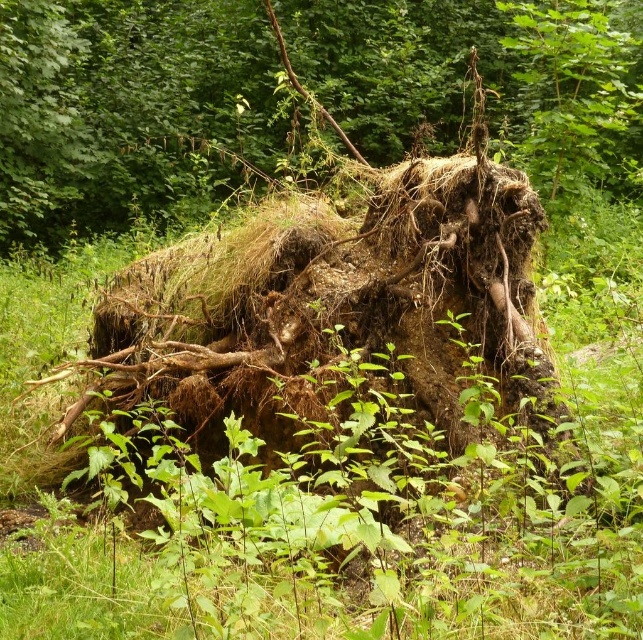
Measure the distance between brown/rooty tree stump at center and green leafy grass at center.

They are 7.78 meters apart.

The height and width of the screenshot is (640, 643). What do you see at coordinates (296, 97) in the screenshot?
I see `brown/rooty tree stump at center` at bounding box center [296, 97].

Identify the location of brown/rooty tree stump at center. The image size is (643, 640). (296, 97).